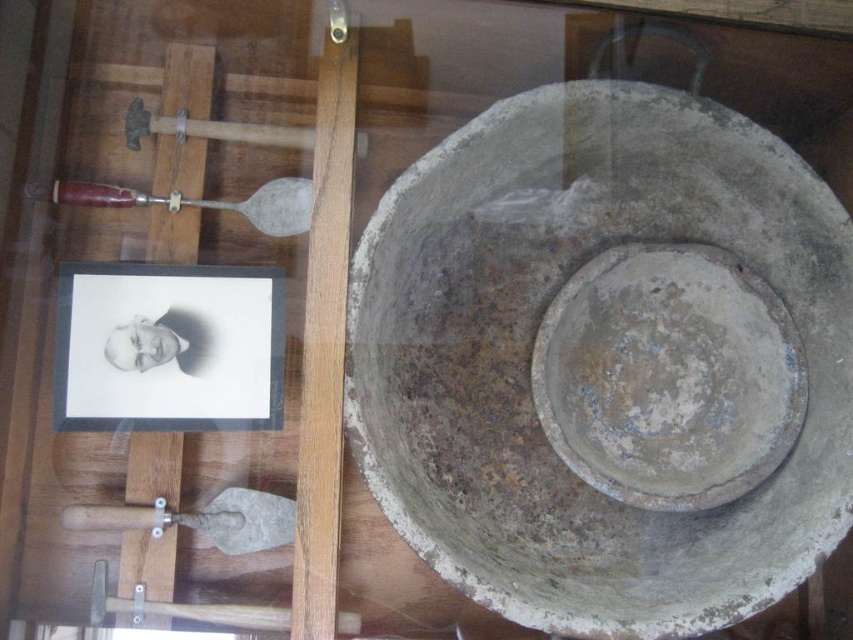
You are a visitor standing in front of the display case. You notice an object labeled as wooden handle shovel at lower left. Where exactly is this object located within the display case?

The wooden handle shovel at lower left is located at point [200,518] within the display case.